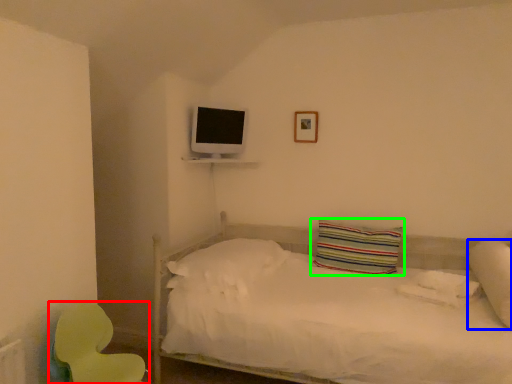
Question: Considering the real-world distances, which object is farthest from swivel chair (highlighted by a red box)? pillow (highlighted by a blue box) or pillow (highlighted by a green box)?

Choices:
 (A) pillow
 (B) pillow

Answer: (A)